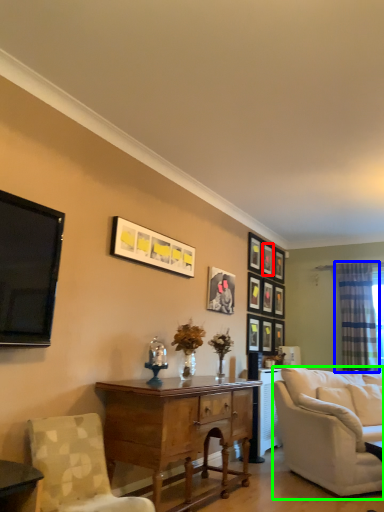
Question: Considering the real-world distances, which object is farthest from picture frame (highlighted by a red box)? curtain (highlighted by a blue box) or studio couch (highlighted by a green box)?

Choices:
 (A) curtain
 (B) studio couch

Answer: (B)